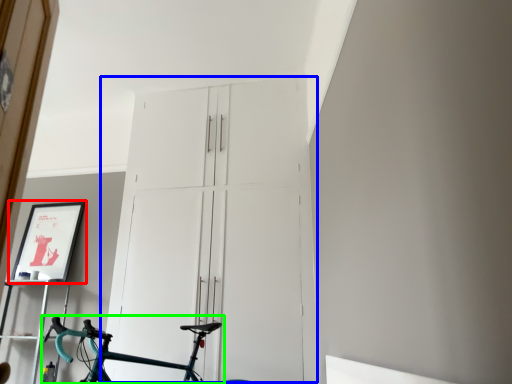
Question: Which is farther away from picture frame (highlighted by a red box)? door (highlighted by a blue box) or bicycle (highlighted by a green box)?

Choices:
 (A) door
 (B) bicycle

Answer: (A)